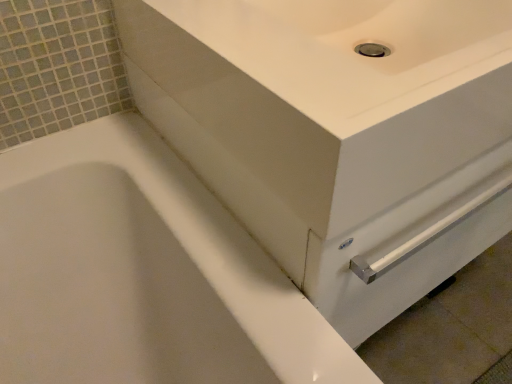
You are a GUI agent. You are given a task and a screenshot of the screen. Output one action in this format:
    pyautogui.click(x=<x>, y=<y>)
    Task: Click on the white glossy porcelain at center
    This screenshot has width=512, height=384.
    Given the screenshot: What is the action you would take?
    pyautogui.click(x=339, y=134)

What is the approximate height of white glossy porcelain at center?

white glossy porcelain at center is 13.34 inches tall.

The height and width of the screenshot is (384, 512). What do you see at coordinates (339, 134) in the screenshot? I see `white glossy porcelain at center` at bounding box center [339, 134].

You are a GUI agent. You are given a task and a screenshot of the screen. Output one action in this format:
    pyautogui.click(x=<x>, y=<y>)
    Task: Click on the white glossy porcelain at center
    The image size is (512, 384).
    Given the screenshot: What is the action you would take?
    pyautogui.click(x=339, y=134)